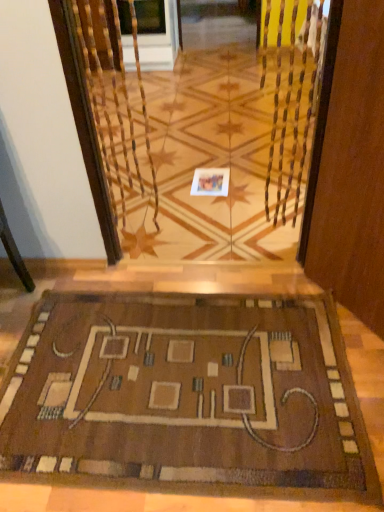
Question: Is transparent glass door at center bigger than white paper at center?

Choices:
 (A) yes
 (B) no

Answer: (A)

Question: Are transparent glass door at center and white paper at center beside each other?

Choices:
 (A) yes
 (B) no

Answer: (B)

Question: Is transparent glass door at center looking in the opposite direction of white paper at center?

Choices:
 (A) yes
 (B) no

Answer: (A)

Question: From a real-world perspective, is transparent glass door at center over white paper at center?

Choices:
 (A) no
 (B) yes

Answer: (B)

Question: Considering the relative positions of transparent glass door at center and white paper at center in the image provided, is transparent glass door at center to the right of white paper at center from the viewer's perspective?

Choices:
 (A) yes
 (B) no

Answer: (B)

Question: Looking at their shapes, would you say transparent glass door at center is wider or thinner than white paper at center?

Choices:
 (A) thin
 (B) wide

Answer: (A)

Question: Considering the relative positions of transparent glass door at center and white paper at center in the image provided, is transparent glass door at center to the left or to the right of white paper at center?

Choices:
 (A) left
 (B) right

Answer: (A)

Question: Is point (312, 109) positioned closer to the camera than point (228, 174)?

Choices:
 (A) closer
 (B) farther

Answer: (A)

Question: Would you say transparent glass door at center is inside or outside white paper at center?

Choices:
 (A) outside
 (B) inside

Answer: (A)

Question: In terms of height, does transparent glass door at center look taller or shorter compared to brown woven mat at lower center?

Choices:
 (A) tall
 (B) short

Answer: (A)

Question: Is transparent glass door at center wider or thinner than brown woven mat at lower center?

Choices:
 (A) thin
 (B) wide

Answer: (A)

Question: From a real-world perspective, relative to brown woven mat at lower center, is transparent glass door at center vertically above or below?

Choices:
 (A) below
 (B) above

Answer: (B)

Question: Is point 178,75 closer or farther from the camera than point 187,401?

Choices:
 (A) closer
 (B) farther

Answer: (B)

Question: Would you say white paper at center is inside or outside brown woven mat at lower center?

Choices:
 (A) outside
 (B) inside

Answer: (A)

Question: Is point (213, 174) positioned closer to the camera than point (165, 297)?

Choices:
 (A) closer
 (B) farther

Answer: (B)